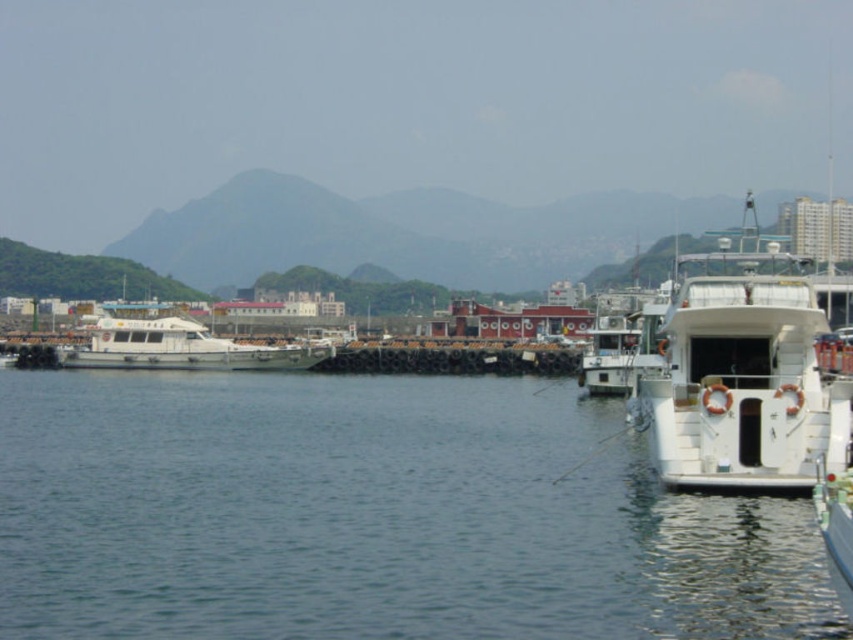
Between clear water at lower left and white matte boat at left, which one appears on the left side from the viewer's perspective?

white matte boat at left

Based on the photo, who is shorter, clear water at lower left or white matte boat at left?

clear water at lower left is shorter.

Is point (146, 604) less distant than point (136, 323)?

Yes, it is in front of point (136, 323).

Image resolution: width=853 pixels, height=640 pixels. In order to click on clear water at lower left in this screenshot , I will do `click(373, 515)`.